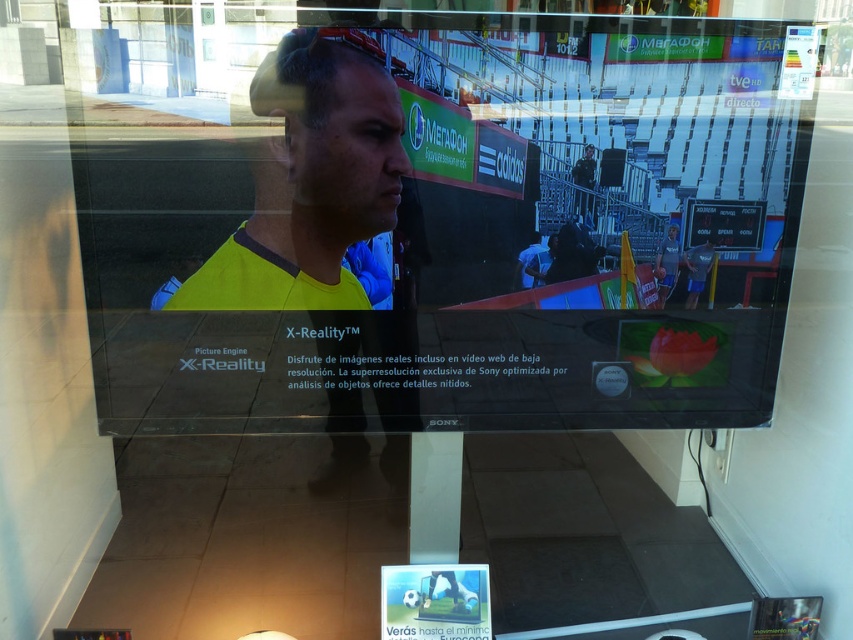
Question: Which point appears closest to the camera in this image?

Choices:
 (A) (415, 136)
 (B) (318, 141)

Answer: (B)

Question: Where is matte black tv at center located in relation to yellow matte shirt at center in the image?

Choices:
 (A) left
 (B) right

Answer: (B)

Question: Which point appears farthest from the camera in this image?

Choices:
 (A) (335, 200)
 (B) (303, 36)

Answer: (A)

Question: Can you confirm if matte black tv at center is positioned below yellow matte shirt at center?

Choices:
 (A) no
 (B) yes

Answer: (B)

Question: Where is matte black tv at center located in relation to yellow matte shirt at center in the image?

Choices:
 (A) left
 (B) right

Answer: (B)